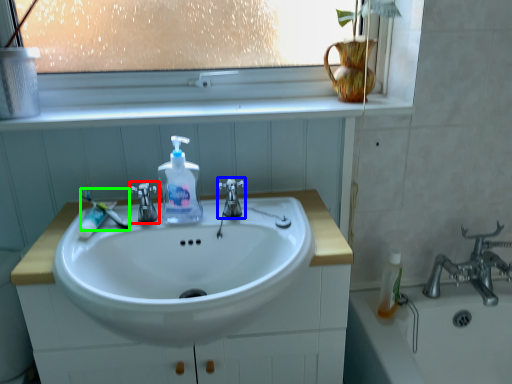
Question: Based on their relative distances, which object is farther from tap (highlighted by a red box)? Choose from tap (highlighted by a blue box) and toothbrush (highlighted by a green box).

Choices:
 (A) tap
 (B) toothbrush

Answer: (A)